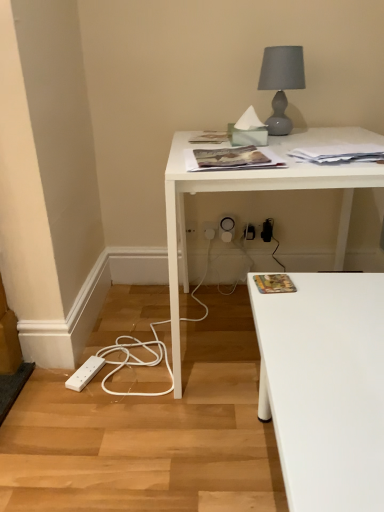
Question: Could you tell me if white plastic electric outlet at lower center, the second electric outlet positioned from the left, is facing white paper at upper right, arranged as the second magazine when ordered from the bottom?

Choices:
 (A) no
 (B) yes

Answer: (A)

Question: Can white paper at upper right, the third magazine when ordered from front to back, be found inside white plastic electric outlet at lower center, the second electric outlet positioned from the left?

Choices:
 (A) no
 (B) yes

Answer: (A)

Question: Considering the relative sizes of white plastic electric outlet at lower center, the second electric outlet positioned from the left, and white paper at upper right, the third magazine when ordered from front to back, in the image provided, is white plastic electric outlet at lower center, the second electric outlet positioned from the left, shorter than white paper at upper right, the third magazine when ordered from front to back,?

Choices:
 (A) yes
 (B) no

Answer: (B)

Question: From a real-world perspective, is white plastic electric outlet at lower center, the first electric outlet when ordered from right to left, positioned under white paper at upper right, which is the 2th magazine in back-to-front order, based on gravity?

Choices:
 (A) yes
 (B) no

Answer: (A)

Question: Is white plastic electric outlet at lower center, the second electric outlet positioned from the left, further to the viewer compared to white paper at upper right, the third magazine when ordered from front to back?

Choices:
 (A) no
 (B) yes

Answer: (B)

Question: Relative to white plastic electric outlet at lower center, acting as the 1th electric outlet starting from the left, is white paper at upper right, placed as the 3th magazine when sorted from top to bottom, in front or behind?

Choices:
 (A) behind
 (B) front

Answer: (B)

Question: Do you think white paper at upper right, the third magazine when ordered from front to back, is within white plastic electric outlet at lower center, placed as the 2th electric outlet when sorted from right to left, or outside of it?

Choices:
 (A) outside
 (B) inside

Answer: (A)

Question: Would you say white paper at upper right, placed as the 3th magazine when sorted from top to bottom, is to the left or to the right of white plastic electric outlet at lower center, acting as the 1th electric outlet starting from the left, in the picture?

Choices:
 (A) right
 (B) left

Answer: (A)

Question: Is white paper at upper right, which is the 2th magazine in back-to-front order, taller or shorter than white plastic electric outlet at lower center, placed as the 2th electric outlet when sorted from right to left?

Choices:
 (A) tall
 (B) short

Answer: (B)

Question: In the image, is white paper at upper right, the third magazine when ordered from front to back, positioned in front of or behind matte paper magazine at center, which is the 1th magazine in top-to-bottom order?

Choices:
 (A) behind
 (B) front

Answer: (B)

Question: From a real-world perspective, is white paper at upper right, which is the 2th magazine in back-to-front order, positioned above or below matte paper magazine at center, the first magazine from the back?

Choices:
 (A) above
 (B) below

Answer: (A)

Question: From the image's perspective, relative to matte paper magazine at center, positioned as the 4th magazine in bottom-to-top order, is white paper at upper right, arranged as the second magazine when ordered from the bottom, above or below?

Choices:
 (A) above
 (B) below

Answer: (B)

Question: Is white paper at upper right, the third magazine when ordered from front to back, wider or thinner than matte paper magazine at center, the first magazine from the back?

Choices:
 (A) wide
 (B) thin

Answer: (B)

Question: Is matte gray glass table lamp at upper right to the left or to the right of printed paper magazine at lower right, the 4th magazine from the back, in the image?

Choices:
 (A) left
 (B) right

Answer: (B)

Question: Is point (281, 46) positioned closer to the camera than point (286, 286)?

Choices:
 (A) farther
 (B) closer

Answer: (A)